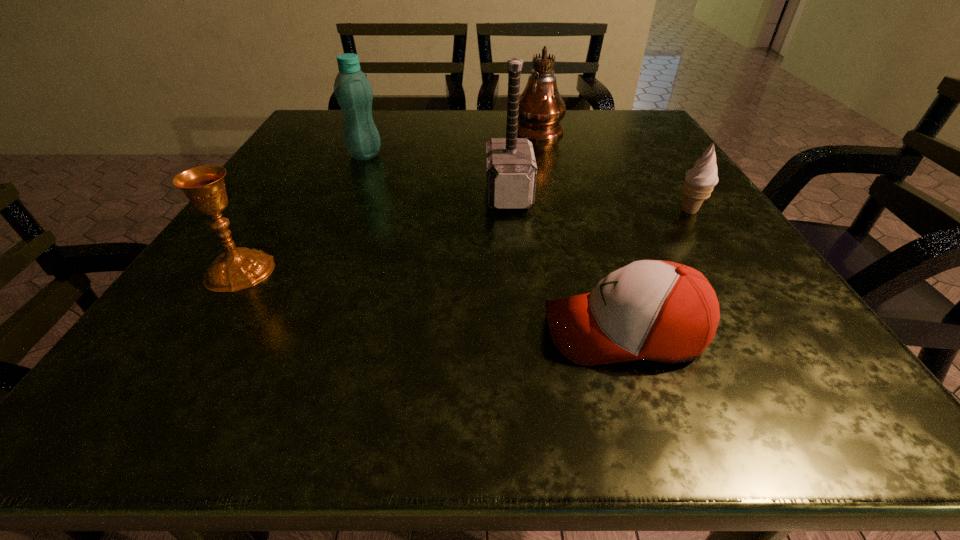
Image resolution: width=960 pixels, height=540 pixels. I want to click on the tallest object, so click(541, 108).

Locate an element on the screen. The width and height of the screenshot is (960, 540). the farthest object is located at coordinates (541, 108).

The image size is (960, 540). I want to click on hammer, so click(x=511, y=171).

The image size is (960, 540). Identify the location of the second object from left to right. (353, 91).

The height and width of the screenshot is (540, 960). What are the coordinates of `water bottle` in the screenshot? It's located at (353, 91).

Where is `the third shortest object`? the third shortest object is located at coordinates (237, 268).

I want to click on chalice, so click(237, 268).

This screenshot has height=540, width=960. Find the location of `the rightmost object`. the rightmost object is located at coordinates (700, 180).

Identify the location of the fifth tallest object. This screenshot has width=960, height=540. (700, 180).

This screenshot has height=540, width=960. What are the coordinates of `the shortest object` in the screenshot? It's located at (663, 311).